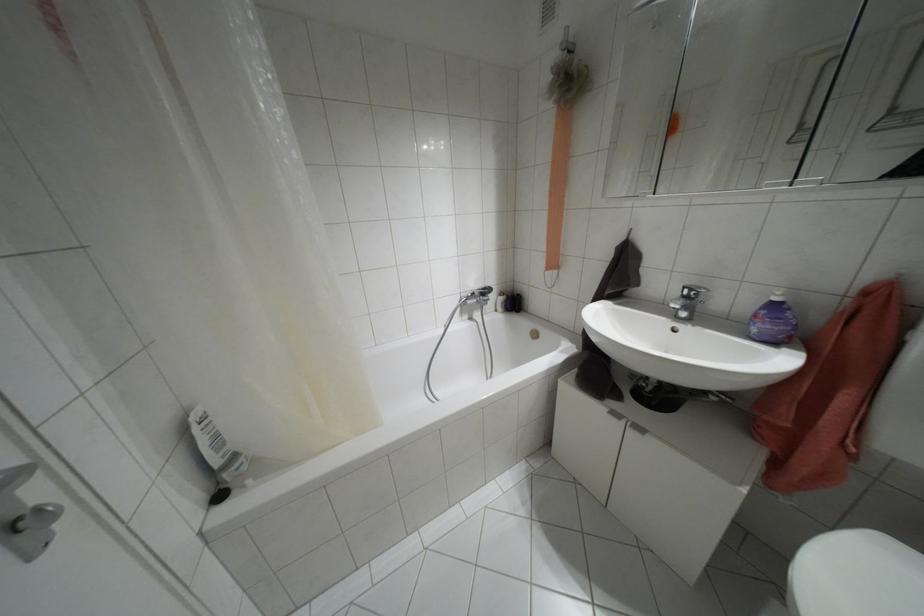
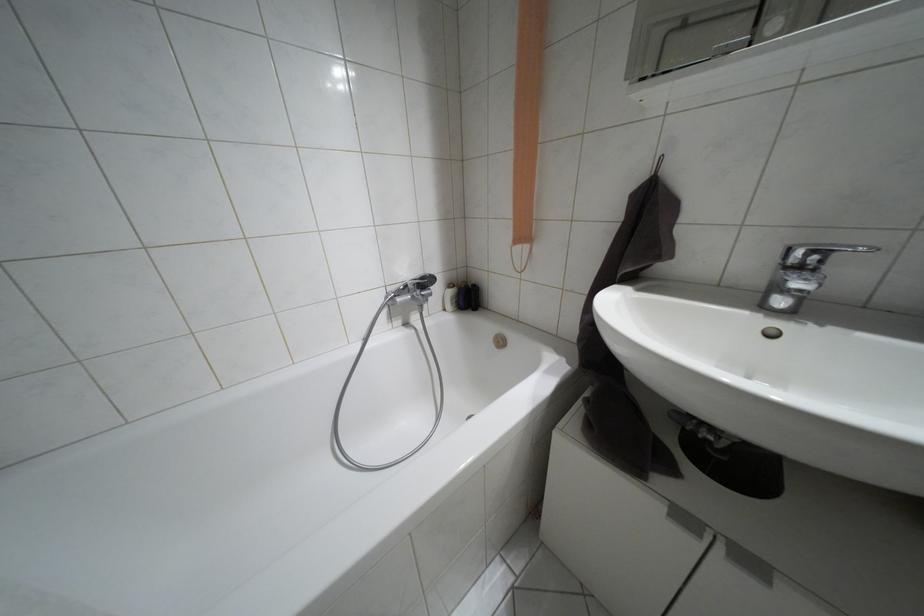
Locate, in the second image, the point that corresponds to (x=689, y=290) in the first image.

(810, 253)